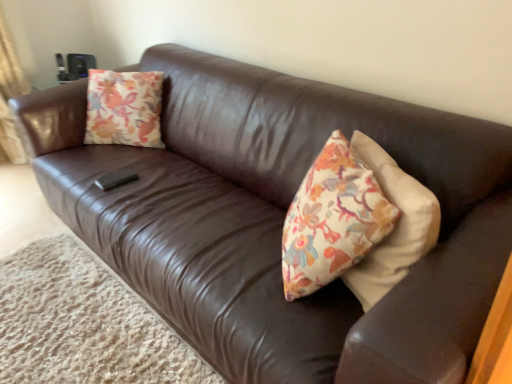
Where is `brown leather couch at lower left`? This screenshot has height=384, width=512. brown leather couch at lower left is located at coordinates (83, 324).

The image size is (512, 384). What do you see at coordinates (83, 324) in the screenshot?
I see `brown leather couch at lower left` at bounding box center [83, 324].

Find the location of `floral-patterned fabric pillow at upper left`. floral-patterned fabric pillow at upper left is located at coordinates click(124, 108).

In order to face floral-patterned fabric pillow at upper left, should I rotate leftwards or rightwards?

To align with it, rotate left about 17.145°.

Describe the element at coordinates (124, 108) in the screenshot. I see `floral-patterned fabric pillow at upper left` at that location.

Image resolution: width=512 pixels, height=384 pixels. I want to click on brown leather couch at lower left, so click(x=83, y=324).

Is brown leather couch at lower left to the left of floral-patterned fabric pillow at upper left from the viewer's perspective?

Yes.

Is brown leather couch at lower left positioned behind floral-patterned fabric pillow at upper left?

No.

Is point (199, 366) farther from viewer compared to point (115, 119)?

No.

From the image's perspective, is brown leather couch at lower left above or below floral-patterned fabric pillow at upper left?

brown leather couch at lower left is situated lower than floral-patterned fabric pillow at upper left in the image.

From a real-world perspective, does brown leather couch at lower left stand above floral-patterned fabric pillow at upper left?

No, from a real-world perspective, brown leather couch at lower left is not over floral-patterned fabric pillow at upper left

Considering the sizes of brown leather couch at lower left and floral-patterned fabric pillow at upper left in the image, is brown leather couch at lower left wider or thinner than floral-patterned fabric pillow at upper left?

brown leather couch at lower left is wider than floral-patterned fabric pillow at upper left.

Looking at this image, is brown leather couch at lower left taller than floral-patterned fabric pillow at upper left?

In fact, brown leather couch at lower left may be shorter than floral-patterned fabric pillow at upper left.

Based on the photo, between brown leather couch at lower left and floral-patterned fabric pillow at upper left, which one has smaller size?

floral-patterned fabric pillow at upper left.

Is brown leather couch at lower left located outside floral-patterned fabric pillow at upper left?

brown leather couch at lower left lies outside floral-patterned fabric pillow at upper left's area.

Are brown leather couch at lower left and floral-patterned fabric pillow at upper left located far from each other?

Actually, brown leather couch at lower left and floral-patterned fabric pillow at upper left are a little close together.

Is brown leather couch at lower left oriented away from floral-patterned fabric pillow at upper left?

brown leather couch at lower left does not have its back to floral-patterned fabric pillow at upper left.

In order to click on throw pillow that appears above the brown leather couch at lower left (from the image's perspective) in this screenshot , I will do `click(124, 108)`.

Would you say floral-patterned fabric pillow at upper left is to the left or to the right of brown leather couch at lower left in the picture?

floral-patterned fabric pillow at upper left is positioned on brown leather couch at lower left's right side.

Between floral-patterned fabric pillow at upper left and brown leather couch at lower left, which one is positioned in front?

brown leather couch at lower left is in front.

Which point is more distant from viewer, (88, 136) or (197, 371)?

The point (88, 136) is more distant.

From the image's perspective, which one is positioned higher, floral-patterned fabric pillow at upper left or brown leather couch at lower left?

From the image's view, floral-patterned fabric pillow at upper left is above.

Looking at this image, from a real-world perspective, is floral-patterned fabric pillow at upper left below brown leather couch at lower left?

Incorrect, from a real-world perspective, floral-patterned fabric pillow at upper left is higher than brown leather couch at lower left.

Does floral-patterned fabric pillow at upper left have a greater width compared to brown leather couch at lower left?

No.

Is floral-patterned fabric pillow at upper left shorter than brown leather couch at lower left?

No.

In terms of size, does floral-patterned fabric pillow at upper left appear bigger or smaller than brown leather couch at lower left?

floral-patterned fabric pillow at upper left is smaller than brown leather couch at lower left.

Do you think floral-patterned fabric pillow at upper left is within brown leather couch at lower left, or outside of it?

floral-patterned fabric pillow at upper left is outside brown leather couch at lower left.

Are floral-patterned fabric pillow at upper left and brown leather couch at lower left located far from each other?

No.

Could you tell me if floral-patterned fabric pillow at upper left is facing brown leather couch at lower left?

No, floral-patterned fabric pillow at upper left does not turn towards brown leather couch at lower left.

What's the angular difference between floral-patterned fabric pillow at upper left and brown leather couch at lower left's facing directions?

There is a 143-degree angle between the facing directions of floral-patterned fabric pillow at upper left and brown leather couch at lower left.

How much distance is there between floral-patterned fabric pillow at upper left and brown leather couch at lower left?

floral-patterned fabric pillow at upper left is 32.27 inches away from brown leather couch at lower left.

The width and height of the screenshot is (512, 384). In order to click on plain below the floral-patterned fabric pillow at upper left (from the image's perspective) in this screenshot , I will do `click(83, 324)`.

At what (x,y) coordinates should I click in order to perform the action: click on plain below the floral-patterned fabric pillow at upper left (from a real-world perspective). Please return your answer as a coordinate pair (x, y). Looking at the image, I should click on (83, 324).

Identify the location of throw pillow above the brown leather couch at lower left (from the image's perspective). This screenshot has width=512, height=384. (124, 108).